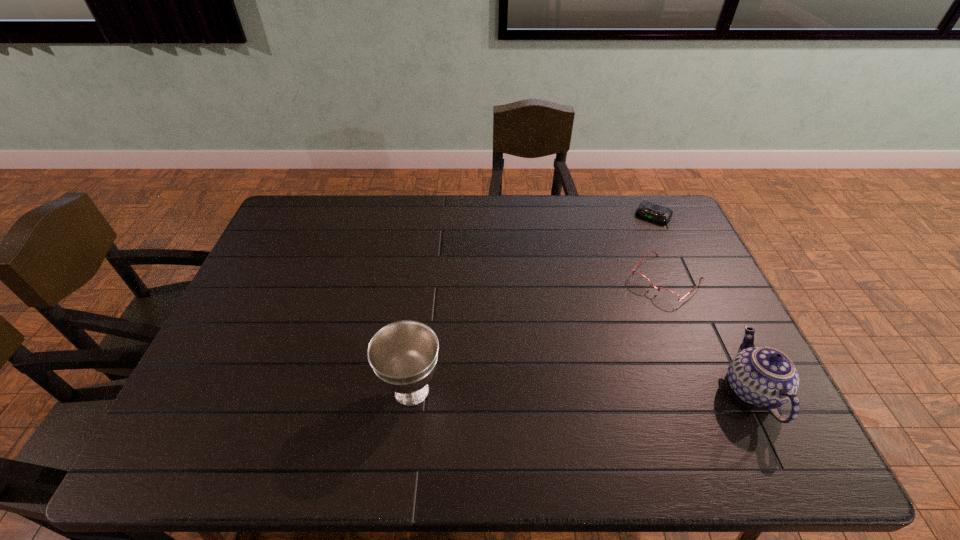
At what (x,y) coordinates should I click in order to perform the action: click on free space located on the display of the alarm clock. Please return your answer as a coordinate pair (x, y). Looking at the image, I should click on (638, 240).

Locate an element on the screen. The height and width of the screenshot is (540, 960). free region located on the lenses of the spectacles is located at coordinates (568, 375).

You are a GUI agent. You are given a task and a screenshot of the screen. Output one action in this format:
    pyautogui.click(x=<x>, y=<y>)
    Task: Click on the vacant area situated on the lenses of the spectacles
    The image size is (960, 540).
    Given the screenshot: What is the action you would take?
    pyautogui.click(x=587, y=356)

Locate an element on the screen. The image size is (960, 540). vacant space situated 0.350m on the lenses of the spectacles is located at coordinates (575, 368).

Locate an element on the screen. Image resolution: width=960 pixels, height=540 pixels. object located in the far edge section of the desktop is located at coordinates (659, 214).

Locate an element on the screen. chalice situated at the near edge is located at coordinates (403, 354).

Locate an element on the screen. The height and width of the screenshot is (540, 960). chinaware that is positioned at the near edge is located at coordinates (765, 377).

Where is `chinaware that is at the right edge`? The image size is (960, 540). chinaware that is at the right edge is located at coordinates (765, 377).

The image size is (960, 540). What are the coordinates of `alarm clock that is at the right edge` in the screenshot? It's located at (659, 214).

Where is `spectacles that is at the right edge`? spectacles that is at the right edge is located at coordinates (640, 278).